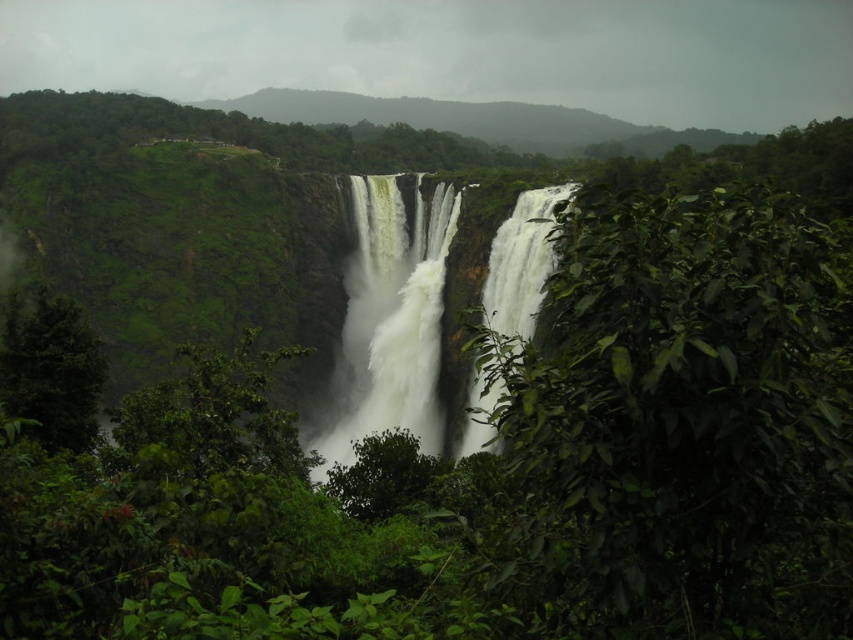
Question: Among these points, which one is farthest from the camera?

Choices:
 (A) (76, 332)
 (B) (399, 342)
 (C) (541, 225)
 (D) (730, 588)

Answer: (B)

Question: Among these points, which one is nearest to the camera?

Choices:
 (A) (524, 314)
 (B) (404, 419)
 (C) (631, 358)
 (D) (15, 358)

Answer: (C)

Question: Is green leafy tree at left smaller than white frothy water at center?

Choices:
 (A) yes
 (B) no

Answer: (A)

Question: Is green leafy bush at right further to the viewer compared to white frothy water at center?

Choices:
 (A) yes
 (B) no

Answer: (B)

Question: Can you confirm if green leafy bush at right is wider than white frothy water at center?

Choices:
 (A) no
 (B) yes

Answer: (B)

Question: Which of these objects is positioned farthest from the green leafy tree at left?

Choices:
 (A) green leafy bush at right
 (B) white frothy water at center

Answer: (B)